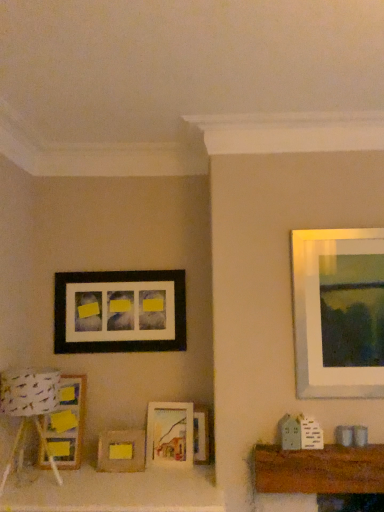
Question: Is matte wooden picture frame at lower left, which ranks as the second picture frame in top-to-bottom order, located within wooden picture frame at center, which ranks as the fourth picture frame in top-to-bottom order?

Choices:
 (A) no
 (B) yes

Answer: (A)

Question: Is wooden picture frame at center, which ranks as the fourth picture frame in top-to-bottom order, positioned before matte wooden picture frame at lower left, the 4th picture frame from the bottom?

Choices:
 (A) yes
 (B) no

Answer: (B)

Question: Would you say wooden picture frame at center, which is the 2th picture frame from bottom to top, is a long distance from matte wooden picture frame at lower left, which ranks as the second picture frame in top-to-bottom order?

Choices:
 (A) no
 (B) yes

Answer: (A)

Question: Is wooden picture frame at center, which ranks as the fourth picture frame in top-to-bottom order, located outside matte wooden picture frame at lower left, the 4th picture frame from the bottom?

Choices:
 (A) no
 (B) yes

Answer: (B)

Question: From the image's perspective, is wooden picture frame at center, which is the 2th picture frame from bottom to top, above matte wooden picture frame at lower left, the 4th picture frame from the bottom?

Choices:
 (A) no
 (B) yes

Answer: (A)

Question: Is matte wooden picture frame at center, which is the third picture frame in top-to-bottom order, inside the boundaries of matte black picture frame at upper left, placed as the 5th picture frame when sorted from bottom to top, or outside?

Choices:
 (A) inside
 (B) outside

Answer: (B)

Question: In terms of size, does matte wooden picture frame at center, the third picture frame positioned from the bottom, appear bigger or smaller than matte black picture frame at upper left, placed as the 5th picture frame when sorted from bottom to top?

Choices:
 (A) small
 (B) big

Answer: (A)

Question: From a real-world perspective, relative to matte black picture frame at upper left, placed as the 5th picture frame when sorted from bottom to top, is matte wooden picture frame at center, which is the third picture frame in top-to-bottom order, vertically above or below?

Choices:
 (A) below
 (B) above

Answer: (A)

Question: Based on their positions, is matte wooden picture frame at center, which is the third picture frame in top-to-bottom order, located to the left or right of matte black picture frame at upper left, the 1th picture frame in the top-to-bottom sequence?

Choices:
 (A) left
 (B) right

Answer: (B)

Question: Is matte wood picture frame at center, marked as the first picture frame in a bottom-to-top arrangement, spatially inside wooden picture frame at center, which ranks as the fourth picture frame in top-to-bottom order, or outside of it?

Choices:
 (A) inside
 (B) outside

Answer: (B)

Question: Considering the relative positions of matte wood picture frame at center, which is counted as the 5th picture frame, starting from the top, and wooden picture frame at center, which is the 2th picture frame from bottom to top, in the image provided, is matte wood picture frame at center, which is counted as the 5th picture frame, starting from the top, to the left or to the right of wooden picture frame at center, which is the 2th picture frame from bottom to top,?

Choices:
 (A) right
 (B) left

Answer: (B)

Question: From a real-world perspective, is matte wood picture frame at center, marked as the first picture frame in a bottom-to-top arrangement, physically located above or below wooden picture frame at center, which is the 2th picture frame from bottom to top?

Choices:
 (A) below
 (B) above

Answer: (A)

Question: Relative to wooden picture frame at center, which is the 2th picture frame from bottom to top, is matte wood picture frame at center, which is counted as the 5th picture frame, starting from the top, in front or behind?

Choices:
 (A) front
 (B) behind

Answer: (A)

Question: Is point (59, 373) positioned closer to the camera than point (56, 462)?

Choices:
 (A) closer
 (B) farther

Answer: (B)

Question: From the image's perspective, is white paper lampshade at lower left above or below matte wooden picture frame at lower left, the 4th picture frame from the bottom?

Choices:
 (A) above
 (B) below

Answer: (A)